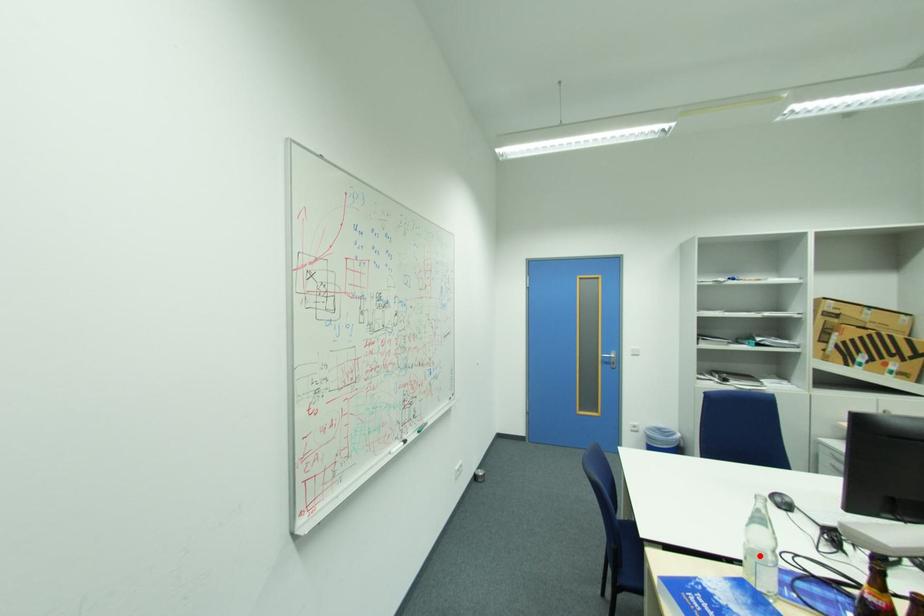
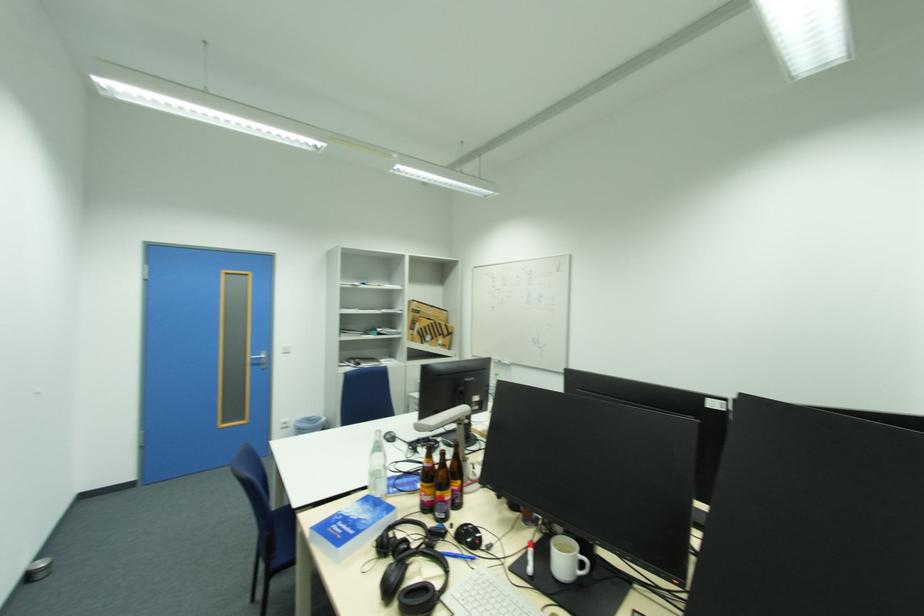
Where in the second image is the point corresponding to the highlighted location from the first image?

(380, 476)